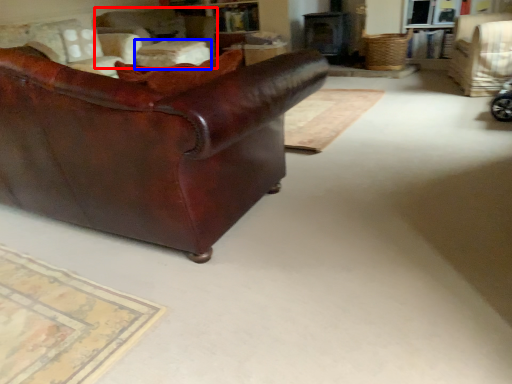
Question: Among these objects, which one is nearest to the camera, chair (highlighted by a red box) or table (highlighted by a blue box)?

Choices:
 (A) chair
 (B) table

Answer: (B)